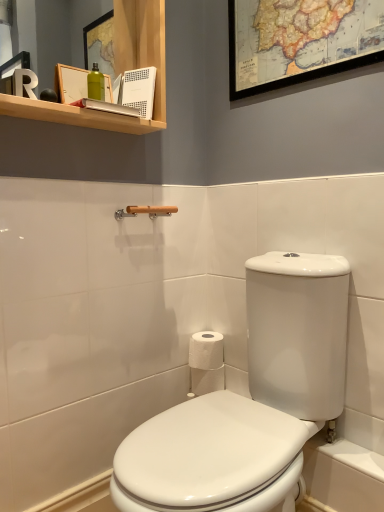
Describe the element at coordinates (251, 401) in the screenshot. I see `white glossy toilet at center` at that location.

What are the coordinates of `wooden towel bar at upper center` in the screenshot? It's located at (151, 210).

The height and width of the screenshot is (512, 384). What do you see at coordinates (206, 380) in the screenshot?
I see `white paper at center` at bounding box center [206, 380].

This screenshot has height=512, width=384. Find the location of `wooden map at upper center`. wooden map at upper center is located at coordinates (296, 41).

Image resolution: width=384 pixels, height=512 pixels. Find the location of `wooden shelf at upper left`. wooden shelf at upper left is located at coordinates (121, 67).

Is white paper at center looking in the opposite direction of wooden shelf at upper left?

No, white paper at center is not facing the opposite direction of wooden shelf at upper left.

Is white paper at center to the left of wooden shelf at upper left from the viewer's perspective?

No.

Looking at this image, from the image's perspective, does white paper at center appear higher than wooden shelf at upper left?

Actually, white paper at center appears below wooden shelf at upper left in the image.

Considering the sizes of objects white glossy toilet at center and wooden towel bar at upper center in the image provided, who is smaller, white glossy toilet at center or wooden towel bar at upper center?

wooden towel bar at upper center is smaller.

Does white glossy toilet at center turn towards wooden towel bar at upper center?

No, white glossy toilet at center is not facing towards wooden towel bar at upper center.

From the image's perspective, is white glossy toilet at center located beneath wooden towel bar at upper center?

Yes, from the image's perspective, white glossy toilet at center is below wooden towel bar at upper center.

Would you say wooden towel bar at upper center is part of white glossy toilet at center's contents?

No, white glossy toilet at center does not contain wooden towel bar at upper center.

Which is more to the right, white paper at center or wooden towel bar at upper center?

white paper at center.

From a real-world perspective, is white paper at center physically above wooden towel bar at upper center?

Incorrect, from a real-world perspective, white paper at center is lower than wooden towel bar at upper center.

Find the location of `toilet paper that appears below the wooden towel bar at upper center (from a real-world perspective)`. toilet paper that appears below the wooden towel bar at upper center (from a real-world perspective) is located at coordinates (206, 380).

Does point (192, 386) lie in front of point (332, 23)?

No, (192, 386) is behind (332, 23).

From the image's perspective, is white paper at center over wooden map at upper center?

Incorrect, from the image's perspective, white paper at center is lower than wooden map at upper center.

Which object is closer to the camera taking this photo, white paper at center or wooden map at upper center?

Positioned in front is wooden map at upper center.

Considering the sizes of objects wooden map at upper center and wooden towel bar at upper center in the image provided, who is shorter, wooden map at upper center or wooden towel bar at upper center?

wooden towel bar at upper center is shorter.

From a real-world perspective, is wooden map at upper center located beneath wooden towel bar at upper center?

Incorrect, from a real-world perspective, wooden map at upper center is higher than wooden towel bar at upper center.

Looking at this image, visually, is wooden map at upper center positioned to the left or to the right of wooden towel bar at upper center?

wooden map at upper center is positioned on wooden towel bar at upper center's right side.

The height and width of the screenshot is (512, 384). I want to click on towel bar below the wooden map at upper center (from a real-world perspective), so click(x=151, y=210).

Is wooden shelf at upper left oriented towards white glossy toilet at center?

No, wooden shelf at upper left is not aimed at white glossy toilet at center.

How different are the orientations of wooden shelf at upper left and white glossy toilet at center in degrees?

wooden shelf at upper left and white glossy toilet at center are facing 86.5 degrees away from each other.

Considering the sizes of wooden shelf at upper left and white glossy toilet at center in the image, is wooden shelf at upper left taller or shorter than white glossy toilet at center?

In the image, wooden shelf at upper left appears to be shorter than white glossy toilet at center.

From the image's perspective, between wooden shelf at upper left and white glossy toilet at center, who is located below?

white glossy toilet at center appears lower in the image.

Could you tell me if white glossy toilet at center is turned towards wooden shelf at upper left?

No, white glossy toilet at center does not turn towards wooden shelf at upper left.

Looking at their sizes, would you say white glossy toilet at center is wider or thinner than wooden shelf at upper left?

Considering their sizes, white glossy toilet at center looks broader than wooden shelf at upper left.

Looking at this image, considering the positions of objects white glossy toilet at center and wooden shelf at upper left in the image provided, who is behind, white glossy toilet at center or wooden shelf at upper left?

wooden shelf at upper left.

From the image's perspective, between white glossy toilet at center and wooden shelf at upper left, which one is located above?

wooden shelf at upper left appears higher in the image.

The image size is (384, 512). Find the location of `bathroom cabinet in front of the white paper at center`. bathroom cabinet in front of the white paper at center is located at coordinates (121, 67).

I want to click on towel bar that is on the left side of white glossy toilet at center, so click(x=151, y=210).

Based on their spatial positions, is wooden shelf at upper left or wooden map at upper center further from wooden towel bar at upper center?

Based on the image, wooden map at upper center appears to be further to wooden towel bar at upper center.

Which object lies further to the anchor point wooden shelf at upper left, white paper at center or white glossy toilet at center?

Among the two, white paper at center is located further to wooden shelf at upper left.

Estimate the real-world distances between objects in this image. Which object is further from wooden towel bar at upper center, wooden shelf at upper left or white glossy toilet at center?

white glossy toilet at center lies further to wooden towel bar at upper center than the other object.

From the picture: Estimate the real-world distances between objects in this image. Which object is further from white glossy toilet at center, wooden towel bar at upper center or wooden shelf at upper left?

The object further to white glossy toilet at center is wooden shelf at upper left.

Which object lies further to the anchor point wooden map at upper center, wooden shelf at upper left or white glossy toilet at center?

white glossy toilet at center lies further to wooden map at upper center than the other object.

Looking at this image, which object lies further to the anchor point wooden map at upper center, white paper at center or wooden shelf at upper left?

white paper at center.

Which object lies further to the anchor point wooden shelf at upper left, wooden map at upper center or wooden towel bar at upper center?

Based on the image, wooden map at upper center appears to be further to wooden shelf at upper left.

Estimate the real-world distances between objects in this image. Which object is closer to wooden shelf at upper left, wooden map at upper center or white glossy toilet at center?

wooden map at upper center is positioned closer to the anchor wooden shelf at upper left.

The height and width of the screenshot is (512, 384). Identify the location of towel bar situated between wooden shelf at upper left and wooden map at upper center from left to right. (151, 210).

This screenshot has width=384, height=512. Find the location of `bathroom cabinet between wooden map at upper center and white paper at center in the up-down direction`. bathroom cabinet between wooden map at upper center and white paper at center in the up-down direction is located at coordinates (121, 67).

This screenshot has height=512, width=384. In order to click on towel bar between wooden map at upper center and white paper at center from top to bottom in this screenshot , I will do `click(151, 210)`.

The height and width of the screenshot is (512, 384). In order to click on towel bar between wooden shelf at upper left and white glossy toilet at center vertically in this screenshot , I will do `click(151, 210)`.